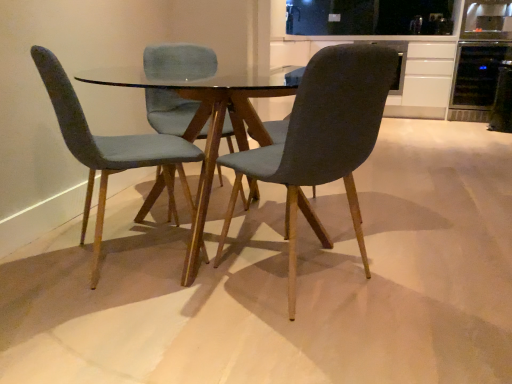
Find the location of a particular element. This screenshot has height=384, width=512. free spot in front of velvet teal chair at left, the 1th chair in the left-to-right sequence is located at coordinates (116, 320).